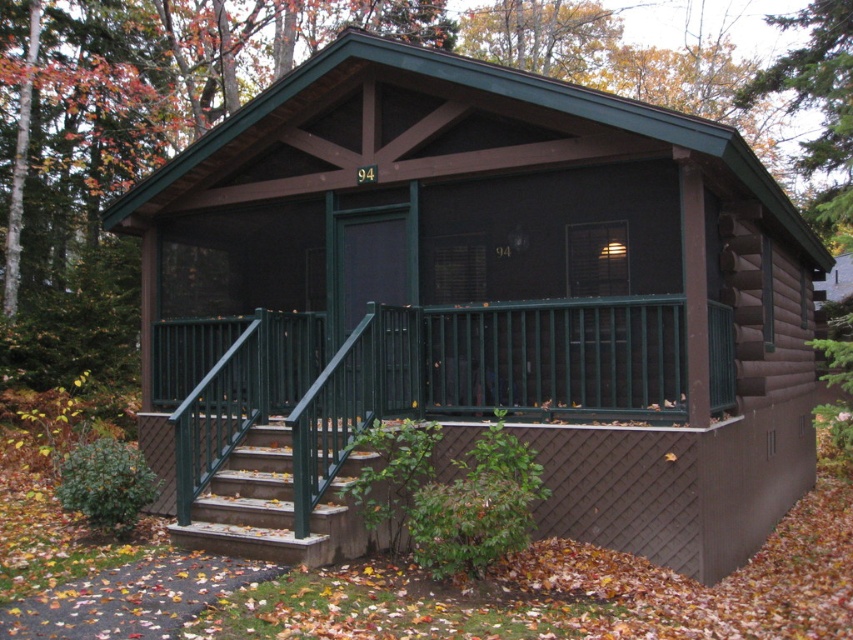
You are standing on the ground in front of the cabin and want to reach the porch. You see the green metal railing at center and the green concrete stairs at lower left. Which object is closer to you?

The green concrete stairs at lower left is behind the green metal railing at center, so the green metal railing at center is closer to you.

You are standing at the entrance of the cabin and looking towards the front porch. There are two points marked in the scene. The first point is at coordinates point (x=202, y=385) and the second is at point (x=218, y=509). Which point is closer to you?

Point (x=218, y=509) is closer to you because it is in front of point (x=202, y=385).

You are standing at the base of the cabin steps and want to walk to the point labeled point (x=561, y=353). Which direction should you go relative to point (x=819, y=51)?

You should walk towards the point (x=561, y=353), which is in front of point (x=819, y=51).